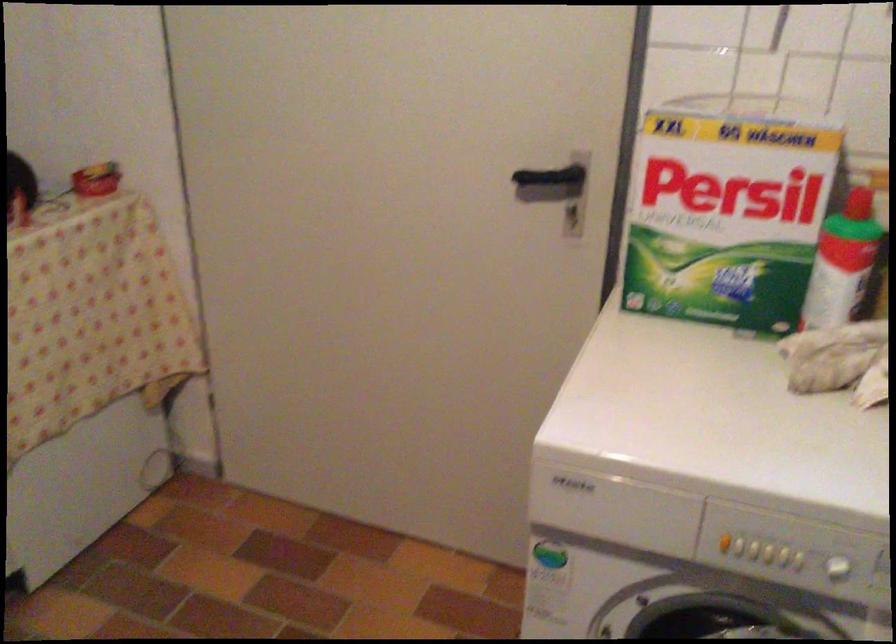
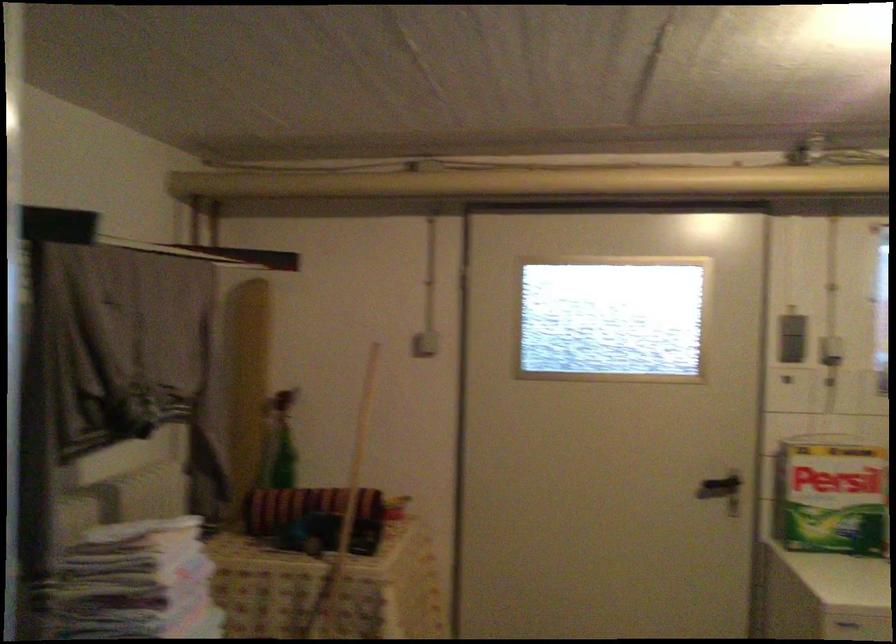
From the picture: In a continuous first-person perspective shot, in which direction is the camera moving?

The movement direction of the cameraman is left, backward.